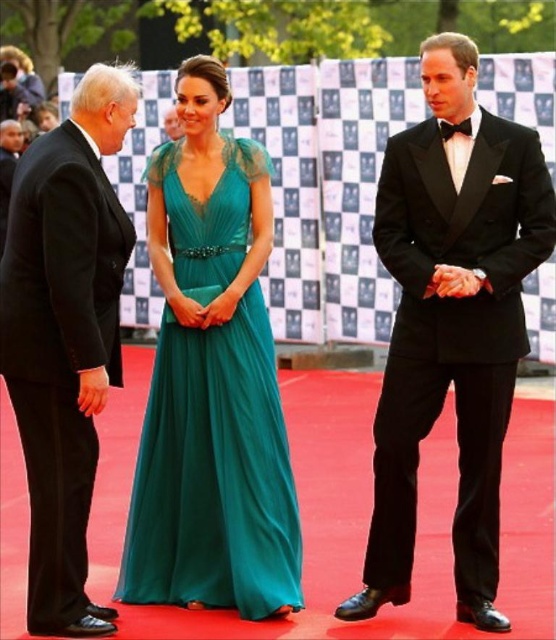
Measure the distance from black satin tuxedo at center to emerald green chiffon dress at center.

A distance of 4.59 feet exists between black satin tuxedo at center and emerald green chiffon dress at center.

Does black satin tuxedo at center appear on the right side of emerald green chiffon dress at center?

Correct, you'll find black satin tuxedo at center to the right of emerald green chiffon dress at center.

Between point (450, 93) and point (181, 412), which one is positioned in front?

Point (450, 93) is more forward.

At what (x,y) coordinates should I click in order to perform the action: click on black satin tuxedo at center. Please return your answer as a coordinate pair (x, y). Looking at the image, I should click on (451, 321).

Can you confirm if emerald green chiffon dress at center is thinner than black satin suit at left?

No.

Looking at this image, which of these two, emerald green chiffon dress at center or black satin suit at left, stands shorter?

With less height is emerald green chiffon dress at center.

The image size is (556, 640). Identify the location of emerald green chiffon dress at center. (214, 474).

Where is `emerald green chiffon dress at center`? Image resolution: width=556 pixels, height=640 pixels. emerald green chiffon dress at center is located at coordinates (214, 474).

What do you see at coordinates (451, 321) in the screenshot?
I see `black satin tuxedo at center` at bounding box center [451, 321].

Which is in front, point (499, 220) or point (26, 150)?

Positioned in front is point (499, 220).

Is point (538, 188) positioned after point (61, 632)?

Yes, point (538, 188) is behind point (61, 632).

You are a GUI agent. You are given a task and a screenshot of the screen. Output one action in this format:
    pyautogui.click(x=<x>, y=<y>)
    Task: Click on the black satin tuxedo at center
    
    Given the screenshot: What is the action you would take?
    pyautogui.click(x=451, y=321)